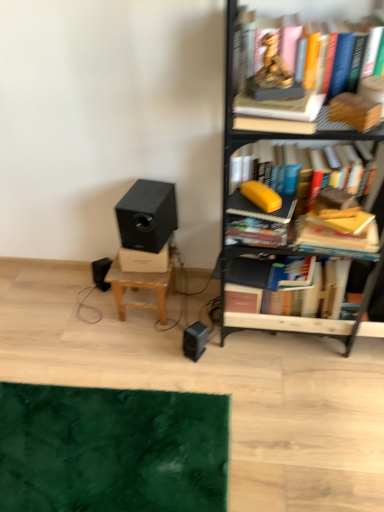
Question: Does metallic black bookcase at right have a lesser height compared to hardcover book at center right, which is counted as the fourth book, starting from the top?

Choices:
 (A) yes
 (B) no

Answer: (B)

Question: From the image's perspective, is metallic black bookcase at right beneath hardcover book at center right, the 1th book ordered from the bottom?

Choices:
 (A) yes
 (B) no

Answer: (B)

Question: Is hardcover book at center right, which is counted as the fourth book, starting from the top, a part of metallic black bookcase at right?

Choices:
 (A) no
 (B) yes

Answer: (B)

Question: Is there a large distance between metallic black bookcase at right and hardcover book at center right, which is counted as the fourth book, starting from the top?

Choices:
 (A) yes
 (B) no

Answer: (B)

Question: Does metallic black bookcase at right appear on the left side of hardcover book at center right, the 1th book ordered from the bottom?

Choices:
 (A) yes
 (B) no

Answer: (B)

Question: From a real-world perspective, relative to black plastic speaker at lower center, is metallic black bookcase at right vertically above or below?

Choices:
 (A) below
 (B) above

Answer: (B)

Question: In terms of size, does metallic black bookcase at right appear bigger or smaller than black plastic speaker at lower center?

Choices:
 (A) big
 (B) small

Answer: (A)

Question: Considering the positions of metallic black bookcase at right and black plastic speaker at lower center in the image, is metallic black bookcase at right taller or shorter than black plastic speaker at lower center?

Choices:
 (A) short
 (B) tall

Answer: (B)

Question: From the image's perspective, is metallic black bookcase at right positioned above or below black plastic speaker at lower center?

Choices:
 (A) above
 (B) below

Answer: (A)

Question: Is point (248, 192) closer or farther from the camera than point (349, 328)?

Choices:
 (A) closer
 (B) farther

Answer: (A)

Question: From the image's perspective, is yellow matte book at center-right, which is the 1th paperback book in bottom-to-top order, located above or below metallic black bookcase at right?

Choices:
 (A) above
 (B) below

Answer: (A)

Question: Considering the positions of yellow matte book at center-right, which is the 1th paperback book in bottom-to-top order, and metallic black bookcase at right in the image, is yellow matte book at center-right, which is the 1th paperback book in bottom-to-top order, taller or shorter than metallic black bookcase at right?

Choices:
 (A) tall
 (B) short

Answer: (B)

Question: From a real-world perspective, relative to metallic black bookcase at right, is yellow matte book at center-right, which is the 1th paperback book in bottom-to-top order, vertically above or below?

Choices:
 (A) above
 (B) below

Answer: (A)

Question: Does point (286, 0) appear closer or farther from the camera than point (243, 193)?

Choices:
 (A) closer
 (B) farther

Answer: (A)

Question: Which is correct: gold statue at upper center, placed as the 4th book when sorted from bottom to top, is inside yellow matte book at center-right, placed as the 3th paperback book when sorted from top to bottom, or outside of it?

Choices:
 (A) outside
 (B) inside

Answer: (A)